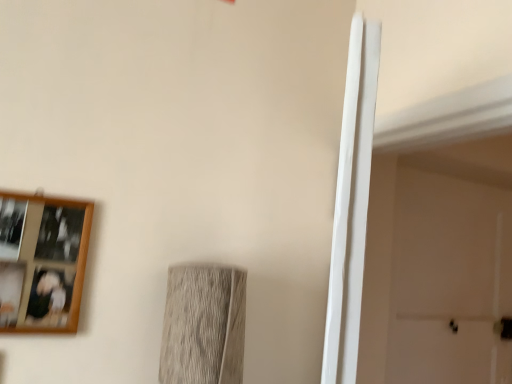
Where is `white matte door at right`? The width and height of the screenshot is (512, 384). white matte door at right is located at coordinates (449, 280).

What do you see at coordinates (449, 280) in the screenshot?
I see `white matte door at right` at bounding box center [449, 280].

What is the approximate height of wooden picture frame at upper left?

wooden picture frame at upper left is 13.02 inches in height.

The image size is (512, 384). Describe the element at coordinates (42, 262) in the screenshot. I see `wooden picture frame at upper left` at that location.

Find the location of a particular element. Image resolution: width=512 pixels, height=384 pixels. wooden picture frame at upper left is located at coordinates (42, 262).

Find the location of a particular element. This screenshot has height=384, width=512. white matte door at right is located at coordinates (449, 280).

Between wooden picture frame at upper left and white matte door at right, which one appears on the left side from the viewer's perspective?

wooden picture frame at upper left is more to the left.

Is wooden picture frame at upper left in front of white matte door at right?

Yes, wooden picture frame at upper left is closer to the viewer.

Is point (78, 290) closer to camera compared to point (480, 362)?

Yes, it is in front of point (480, 362).

From the image's perspective, who appears lower, wooden picture frame at upper left or white matte door at right?

white matte door at right, from the image's perspective.

In the scene shown: From a real-world perspective, between wooden picture frame at upper left and white matte door at right, who is vertically lower?

wooden picture frame at upper left, from a real-world perspective.

Is wooden picture frame at upper left wider than white matte door at right?

No, wooden picture frame at upper left is not wider than white matte door at right.

Is wooden picture frame at upper left taller or shorter than white matte door at right?

Clearly, wooden picture frame at upper left is shorter compared to white matte door at right.

Considering the sizes of objects wooden picture frame at upper left and white matte door at right in the image provided, who is bigger, wooden picture frame at upper left or white matte door at right?

Bigger between the two is white matte door at right.

Is wooden picture frame at upper left surrounding white matte door at right?

No, white matte door at right is not surrounded by wooden picture frame at upper left.

Is wooden picture frame at upper left far away from white matte door at right?

Yes, wooden picture frame at upper left and white matte door at right are located far from each other.

Could you tell me if wooden picture frame at upper left is facing white matte door at right?

No.

I want to click on picture frame above the white matte door at right (from the image's perspective), so click(x=42, y=262).

Which is more to the right, white matte door at right or wooden picture frame at upper left?

white matte door at right is more to the right.

Does white matte door at right lie in front of wooden picture frame at upper left?

No, white matte door at right is further to the viewer.

Does point (408, 245) lie behind point (70, 273)?

Yes, it is.

In the scene shown: From the image's perspective, which object appears higher, white matte door at right or wooden picture frame at upper left?

wooden picture frame at upper left is shown above in the image.

From a real-world perspective, does white matte door at right stand above wooden picture frame at upper left?

Indeed, from a real-world perspective, white matte door at right stands above wooden picture frame at upper left.

Considering the relative sizes of white matte door at right and wooden picture frame at upper left in the image provided, is white matte door at right wider than wooden picture frame at upper left?

Indeed, white matte door at right has a greater width compared to wooden picture frame at upper left.

Considering the relative sizes of white matte door at right and wooden picture frame at upper left in the image provided, is white matte door at right shorter than wooden picture frame at upper left?

No, white matte door at right is not shorter than wooden picture frame at upper left.

Considering the sizes of objects white matte door at right and wooden picture frame at upper left in the image provided, who is smaller, white matte door at right or wooden picture frame at upper left?

With smaller size is wooden picture frame at upper left.

Is white matte door at right outside of wooden picture frame at upper left?

Yes.

Does white matte door at right touch wooden picture frame at upper left?

No, white matte door at right is not beside wooden picture frame at upper left.

Is white matte door at right aimed at wooden picture frame at upper left?

No, white matte door at right is not oriented towards wooden picture frame at upper left.

Locate an element on the screen. Image resolution: width=512 pixels, height=384 pixels. picture frame that appears in front of the white matte door at right is located at coordinates (42, 262).

This screenshot has height=384, width=512. Identify the location of picture frame in front of the white matte door at right. (42, 262).

You are a GUI agent. You are given a task and a screenshot of the screen. Output one action in this format:
    pyautogui.click(x=<x>, y=<y>)
    Task: Click on the door that appears behind the wooden picture frame at upper left
    Image resolution: width=512 pixels, height=384 pixels.
    Given the screenshot: What is the action you would take?
    pyautogui.click(x=449, y=280)